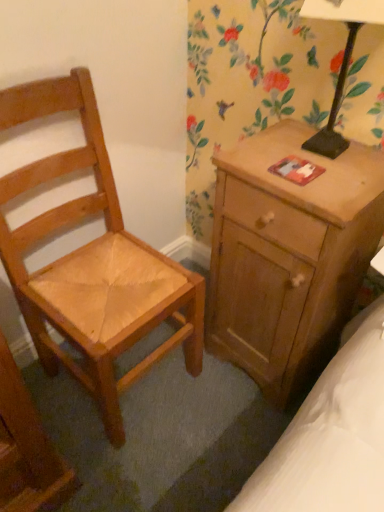
Question: From a real-world perspective, does black metal table lamp at upper right stand above wooden nightstand at right?

Choices:
 (A) no
 (B) yes

Answer: (B)

Question: Does black metal table lamp at upper right have a lesser width compared to wooden nightstand at right?

Choices:
 (A) yes
 (B) no

Answer: (A)

Question: From the image's perspective, is black metal table lamp at upper right on wooden nightstand at right?

Choices:
 (A) no
 (B) yes

Answer: (B)

Question: Is black metal table lamp at upper right in front of wooden nightstand at right?

Choices:
 (A) yes
 (B) no

Answer: (A)

Question: From the image's perspective, does black metal table lamp at upper right appear lower than wooden nightstand at right?

Choices:
 (A) no
 (B) yes

Answer: (A)

Question: From a real-world perspective, is black metal table lamp at upper right positioned under wooden nightstand at right based on gravity?

Choices:
 (A) yes
 (B) no

Answer: (B)

Question: From the image's perspective, is black metal table lamp at upper right above light brown wooden chair at left?

Choices:
 (A) yes
 (B) no

Answer: (A)

Question: Is black metal table lamp at upper right thinner than light brown wooden chair at left?

Choices:
 (A) yes
 (B) no

Answer: (A)

Question: Does black metal table lamp at upper right turn towards light brown wooden chair at left?

Choices:
 (A) yes
 (B) no

Answer: (B)

Question: Is black metal table lamp at upper right bigger than light brown wooden chair at left?

Choices:
 (A) no
 (B) yes

Answer: (A)

Question: Is black metal table lamp at upper right to the left of light brown wooden chair at left from the viewer's perspective?

Choices:
 (A) no
 (B) yes

Answer: (A)

Question: Is black metal table lamp at upper right oriented away from light brown wooden chair at left?

Choices:
 (A) yes
 (B) no

Answer: (B)

Question: Considering the relative sizes of wooden nightstand at right and black metal table lamp at upper right in the image provided, is wooden nightstand at right thinner than black metal table lamp at upper right?

Choices:
 (A) no
 (B) yes

Answer: (A)